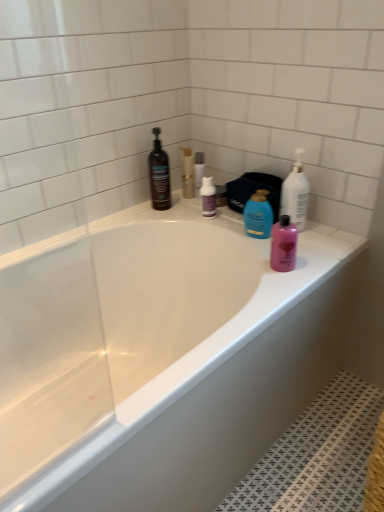
Question: Are white glossy bottle at upper right, the 4th cleaning product in the left-to-right sequence, and purple matte bottle at center, which is the 2th cleaning product in left-to-right order, far apart?

Choices:
 (A) yes
 (B) no

Answer: (B)

Question: Can you confirm if white glossy bottle at upper right, the 4th cleaning product in the left-to-right sequence, is taller than purple matte bottle at center, arranged as the third cleaning product when viewed from the right?

Choices:
 (A) no
 (B) yes

Answer: (B)

Question: From the image's perspective, would you say white glossy bottle at upper right, the 4th cleaning product in the left-to-right sequence, is shown under purple matte bottle at center, arranged as the third cleaning product when viewed from the right?

Choices:
 (A) yes
 (B) no

Answer: (A)

Question: Is white glossy bottle at upper right, which ranks as the first cleaning product in right-to-left order, looking in the opposite direction of purple matte bottle at center, arranged as the third cleaning product when viewed from the right?

Choices:
 (A) no
 (B) yes

Answer: (A)

Question: Can purple matte bottle at center, which is the 2th cleaning product in left-to-right order, be found inside white glossy bottle at upper right, the 4th cleaning product in the left-to-right sequence?

Choices:
 (A) yes
 (B) no

Answer: (B)

Question: Is white glossy bottle at upper right, which ranks as the first cleaning product in right-to-left order, not within purple matte bottle at center, arranged as the third cleaning product when viewed from the right?

Choices:
 (A) no
 (B) yes

Answer: (B)

Question: Is purple matte bottle at center, arranged as the third cleaning product when viewed from the right, shorter than pink glossy bottle at right, arranged as the 1th toiletry when viewed from the right?

Choices:
 (A) no
 (B) yes

Answer: (B)

Question: Is purple matte bottle at center, which is the 2th cleaning product in left-to-right order, positioned beyond the bounds of pink glossy bottle at right, which ranks as the 3th toiletry in top-to-bottom order?

Choices:
 (A) no
 (B) yes

Answer: (B)

Question: Considering the relative sizes of purple matte bottle at center, arranged as the third cleaning product when viewed from the right, and pink glossy bottle at right, the third toiletry from the back, in the image provided, is purple matte bottle at center, arranged as the third cleaning product when viewed from the right, wider than pink glossy bottle at right, the third toiletry from the back,?

Choices:
 (A) no
 (B) yes

Answer: (A)

Question: Is purple matte bottle at center, which is the 2th cleaning product in left-to-right order, with pink glossy bottle at right, the third toiletry when ordered from left to right?

Choices:
 (A) no
 (B) yes

Answer: (A)

Question: Is pink glossy bottle at right, the third toiletry from the back, at the back of purple matte bottle at center, arranged as the third cleaning product when viewed from the right?

Choices:
 (A) no
 (B) yes

Answer: (A)

Question: Are purple matte bottle at center, arranged as the third cleaning product when viewed from the right, and pink glossy bottle at right, arranged as the 1th toiletry when viewed from the right, far apart?

Choices:
 (A) yes
 (B) no

Answer: (B)

Question: From the image's perspective, is clear plastic bottle at upper center, the second toiletry viewed from the left, below matte black bottle at upper left, the 4th cleaning product when ordered from right to left?

Choices:
 (A) yes
 (B) no

Answer: (B)